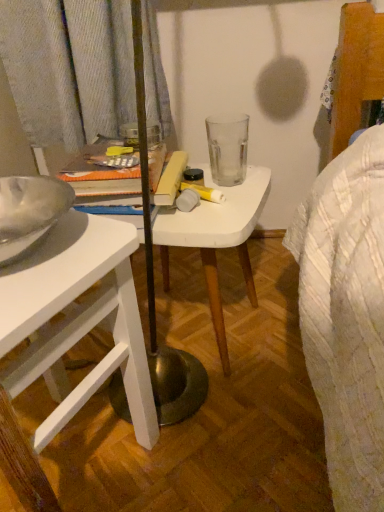
Question: Is white matte table at center taller or shorter than white matte desk at left?

Choices:
 (A) tall
 (B) short

Answer: (B)

Question: From a real-world perspective, relative to white matte desk at left, is white matte table at center vertically above or below?

Choices:
 (A) below
 (B) above

Answer: (A)

Question: Is white matte table at center spatially inside white matte desk at left, or outside of it?

Choices:
 (A) inside
 (B) outside

Answer: (B)

Question: Is point (79, 386) positioned closer to the camera than point (228, 202)?

Choices:
 (A) farther
 (B) closer

Answer: (B)

Question: From a real-world perspective, relative to white matte table at center, is white matte desk at left vertically above or below?

Choices:
 (A) below
 (B) above

Answer: (B)

Question: Is white matte desk at left bigger or smaller than white matte table at center?

Choices:
 (A) small
 (B) big

Answer: (B)

Question: Considering the positions of white matte desk at left and white matte table at center in the image, is white matte desk at left wider or thinner than white matte table at center?

Choices:
 (A) wide
 (B) thin

Answer: (A)